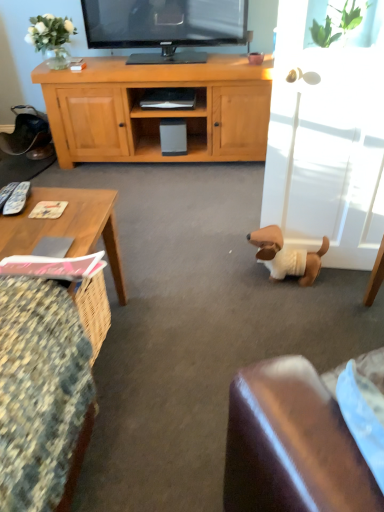
Question: From a real-world perspective, is floral fabric cushion at lower left positioned above or below white glossy glass door at right?

Choices:
 (A) below
 (B) above

Answer: (A)

Question: Is floral fabric cushion at lower left bigger or smaller than white glossy glass door at right?

Choices:
 (A) big
 (B) small

Answer: (B)

Question: Which object is positioned farthest from the white plush dog at lower right?

Choices:
 (A) matte black shelf at center
 (B) floral fabric cushion at lower left
 (C) wooden textured coffee table at lower left
 (D) white glossy glass door at right

Answer: (A)

Question: Which is farther from the floral fabric cushion at lower left?

Choices:
 (A) matte black shelf at center
 (B) white plush dog at lower right
 (C) wooden textured coffee table at lower left
 (D) white glossy glass door at right

Answer: (A)